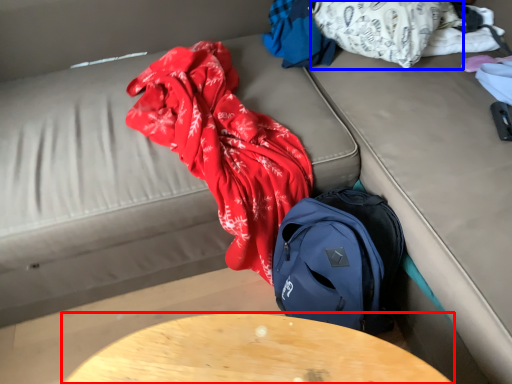
Question: Which of the following is the closest to the observer, table (highlighted by a red box) or clothing (highlighted by a blue box)?

Choices:
 (A) table
 (B) clothing

Answer: (A)